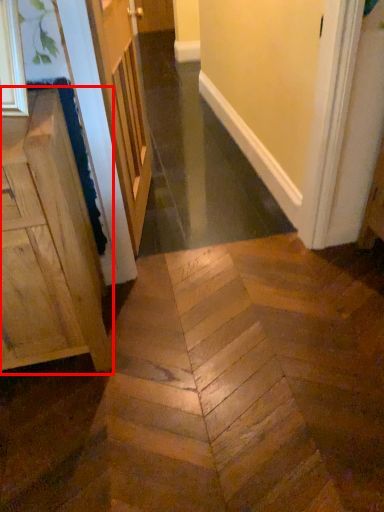
Question: From the image's perspective, where is cabinetry (annotated by the red box) located in relation to door in the image?

Choices:
 (A) below
 (B) above

Answer: (A)